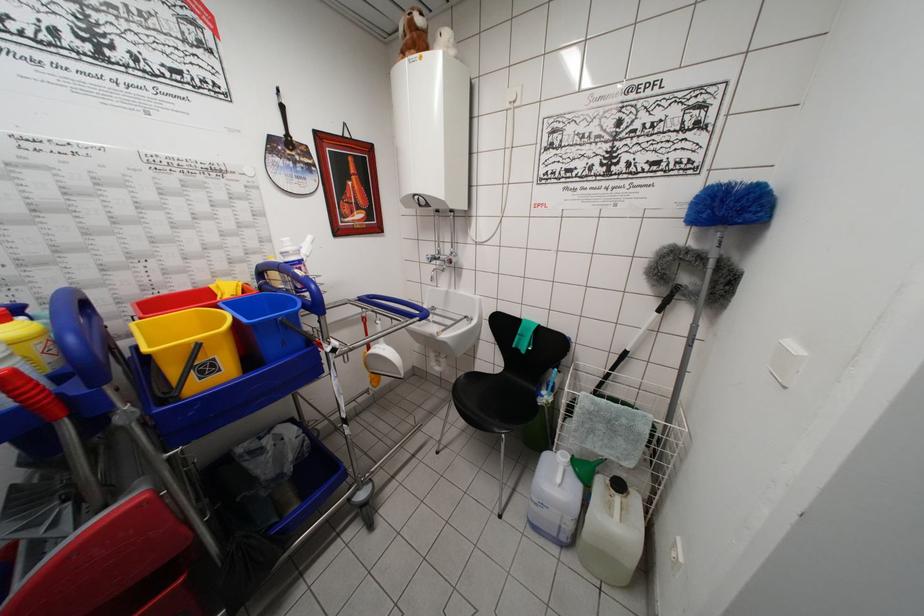
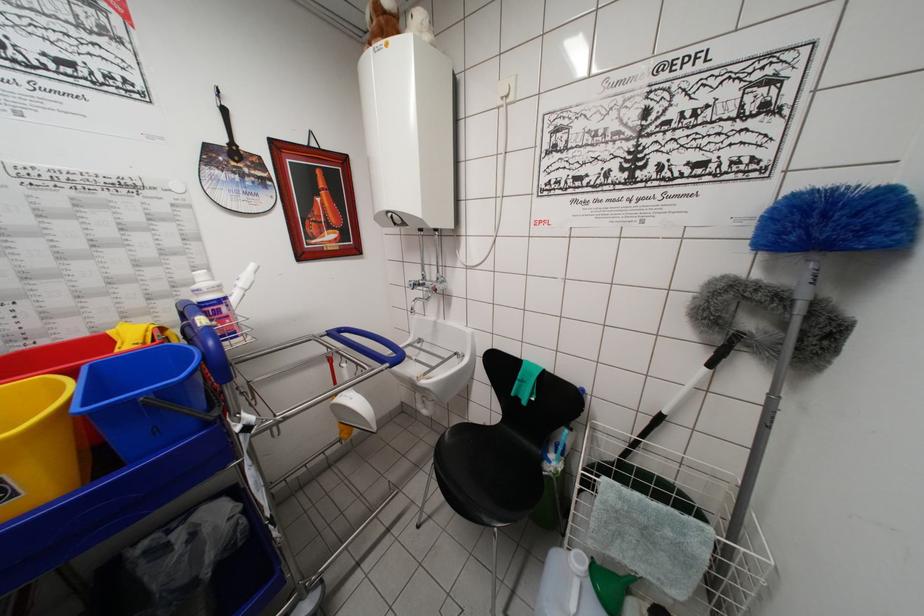
Find the pixel in the second image that matches pixel 277 323 in the first image.

(136, 405)